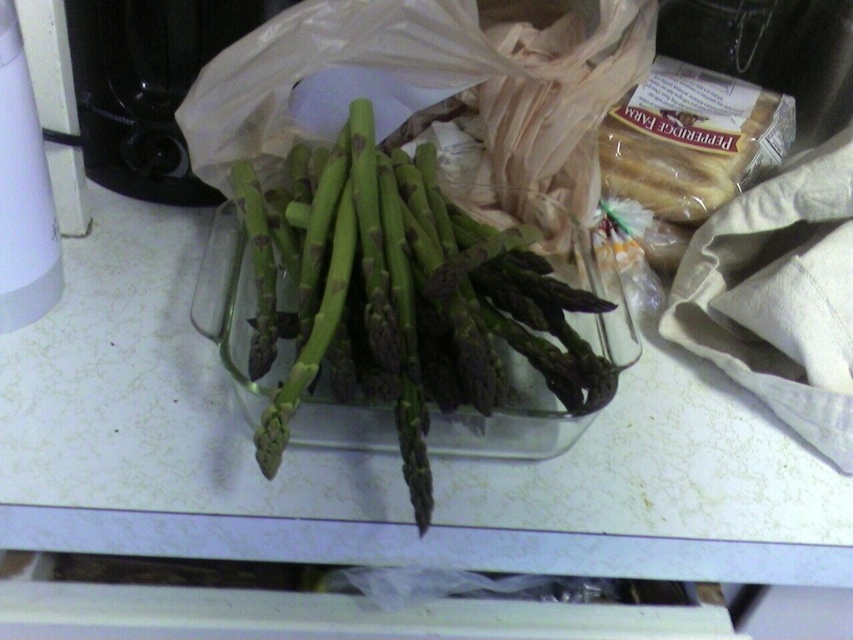
Question: Which point appears farthest from the camera in this image?

Choices:
 (A) (47, 205)
 (B) (103, 136)
 (C) (321, 321)

Answer: (B)

Question: Which object appears farthest from the camera in this image?

Choices:
 (A) green glossy asparagus at center
 (B) white plastic kettle at left
 (C) black plastic toaster at upper left

Answer: (C)

Question: Is black plastic toaster at upper left bigger than white plastic kettle at left?

Choices:
 (A) yes
 (B) no

Answer: (A)

Question: Does green glossy asparagus at center appear on the right side of white plastic kettle at left?

Choices:
 (A) no
 (B) yes

Answer: (B)

Question: Which is farther from the black plastic toaster at upper left?

Choices:
 (A) white plastic kettle at left
 (B) green glossy asparagus at center

Answer: (B)

Question: Does green glossy asparagus at center lie in front of black plastic toaster at upper left?

Choices:
 (A) no
 (B) yes

Answer: (B)